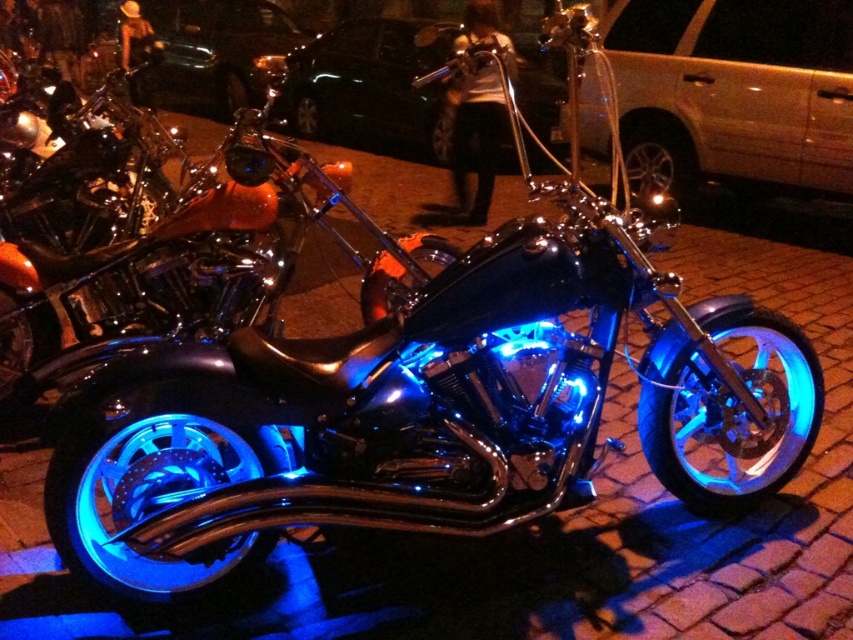
From the picture: Can you confirm if blue illuminated chrome motorcycle at center is wider than glossy black car at upper center?

No, blue illuminated chrome motorcycle at center is not wider than glossy black car at upper center.

What do you see at coordinates (173, 250) in the screenshot?
I see `blue illuminated chrome motorcycle at center` at bounding box center [173, 250].

Image resolution: width=853 pixels, height=640 pixels. Describe the element at coordinates (173, 250) in the screenshot. I see `blue illuminated chrome motorcycle at center` at that location.

What are the coordinates of `blue illuminated chrome motorcycle at center` in the screenshot? It's located at (173, 250).

Is point (653, 16) farther from camera compared to point (381, 92)?

That is False.

Does point (807, 40) lie in front of point (293, 97)?

Yes, it is in front of point (293, 97).

Is point (711, 35) in front of point (442, 93)?

Yes, it is in front of point (442, 93).

Find the location of a particular element. This screenshot has width=853, height=640. metallic gold van at center is located at coordinates (734, 92).

Is blue illuminated chrome motorcycle at center positioned before metallic gold van at center?

Yes, it is.

Who is more forward, (15, 372) or (851, 77)?

Point (15, 372)

This screenshot has height=640, width=853. Identify the location of blue illuminated chrome motorcycle at center. (173, 250).